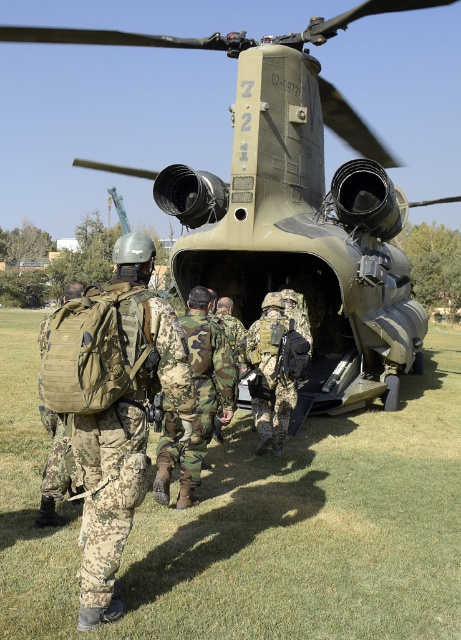
Question: Is camouflage fabric backpack at center thinner than camouflage fabric backpack at left?

Choices:
 (A) yes
 (B) no

Answer: (A)

Question: Does matte green helicopter at center have a smaller size compared to camouflage fabric backpack at left?

Choices:
 (A) yes
 (B) no

Answer: (B)

Question: Does camouflage fabric backpack at center lie in front of camouflage fabric backpack at left?

Choices:
 (A) yes
 (B) no

Answer: (A)

Question: Which object is farther from the camera taking this photo?

Choices:
 (A) camouflage fabric backpack at left
 (B) matte green helicopter at center
 (C) camouflage fabric backpack at center

Answer: (B)

Question: Which object is the closest to the matte green helicopter at center?

Choices:
 (A) camouflage fabric backpack at center
 (B) camouflage fabric backpack at left

Answer: (B)

Question: Estimate the real-world distances between objects in this image. Which object is closer to the camouflage fabric backpack at center?

Choices:
 (A) camouflage fabric backpack at left
 (B) matte green helicopter at center

Answer: (A)